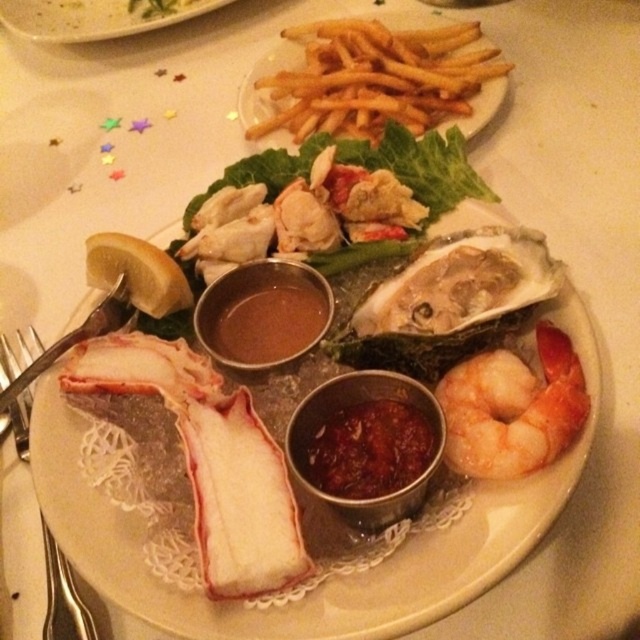
Question: Is shiny silver oyster at center thinner than white glossy plate at center?

Choices:
 (A) yes
 (B) no

Answer: (A)

Question: Is shiny pink shrimp at center to the right of white glossy plate at center from the viewer's perspective?

Choices:
 (A) no
 (B) yes

Answer: (B)

Question: Which point is closer to the camera?

Choices:
 (A) shiny pink shrimp at center
 (B) silver metallic fork at lower left
 (C) shiny silver oyster at center
 (D) golden crispy fries at center

Answer: (A)

Question: Which of the following is the farthest from the observer?

Choices:
 (A) (428, 316)
 (B) (461, 26)
 (C) (592, 340)

Answer: (B)

Question: Estimate the real-world distances between objects in this image. Which object is farther from the golden crispy fries at center?

Choices:
 (A) white glossy plate at center
 (B) shiny silver oyster at center
 (C) shiny pink shrimp at center

Answer: (C)

Question: Does golden crispy fries at center have a larger size compared to shiny silver oyster at center?

Choices:
 (A) no
 (B) yes

Answer: (B)